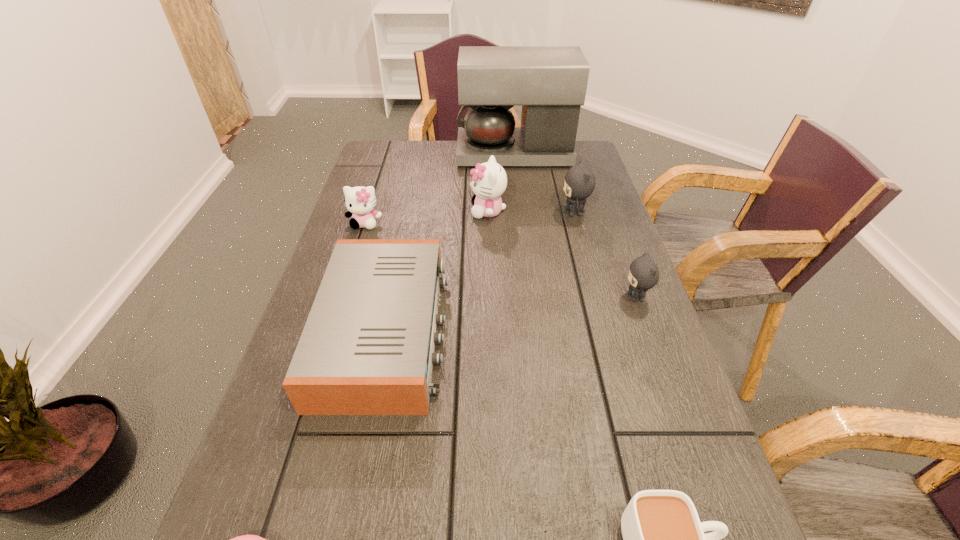
Where is `vacant space located 0.230m on the front-facing side of the leftmost kitten`? The width and height of the screenshot is (960, 540). vacant space located 0.230m on the front-facing side of the leftmost kitten is located at coordinates (343, 292).

Find the location of a particular element. The height and width of the screenshot is (540, 960). vacant space situated on the front-facing side of the nearer gray kitten is located at coordinates (499, 297).

In order to click on free space located 0.160m on the front-facing side of the nearer gray kitten in this screenshot , I will do `click(552, 297)`.

The height and width of the screenshot is (540, 960). In order to click on free point located 0.060m on the front-facing side of the nearer gray kitten in this screenshot , I will do `click(596, 297)`.

In order to click on vacant space situated 0.060m on the front panel of the radio receiver in this screenshot , I will do `click(474, 332)`.

Locate an element on the screen. The image size is (960, 540). object at the far edge is located at coordinates (550, 82).

Locate an element on the screen. This screenshot has height=540, width=960. kitten present at the left edge is located at coordinates (360, 201).

Find the location of a particular element. Image resolution: width=960 pixels, height=540 pixels. radio receiver present at the left edge is located at coordinates (367, 348).

Identify the location of coffee maker at the right edge. Image resolution: width=960 pixels, height=540 pixels. (550, 82).

Identify the location of object that is at the far right corner. (550, 82).